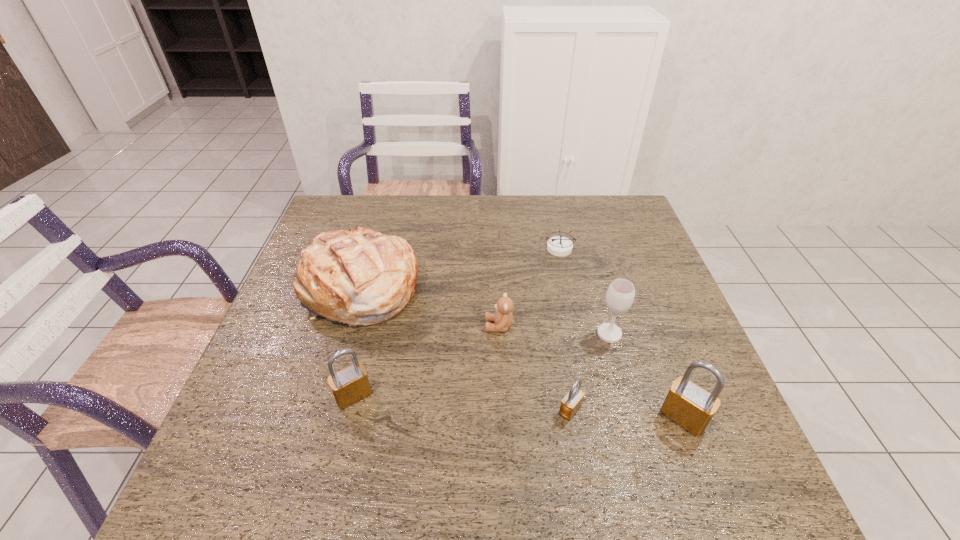
The image size is (960, 540). In order to click on vacant position for inserting another padlock evenly in this screenshot , I will do click(x=460, y=403).